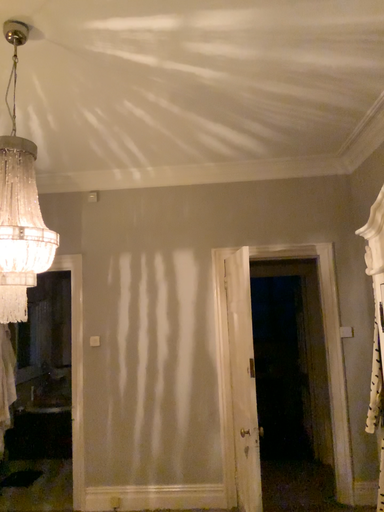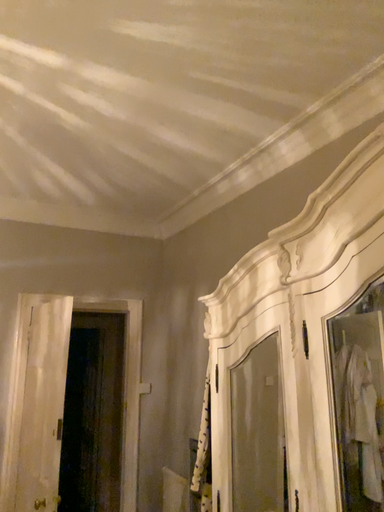
Question: Which way did the camera rotate in the video?

Choices:
 (A) rotated right
 (B) rotated left

Answer: (A)